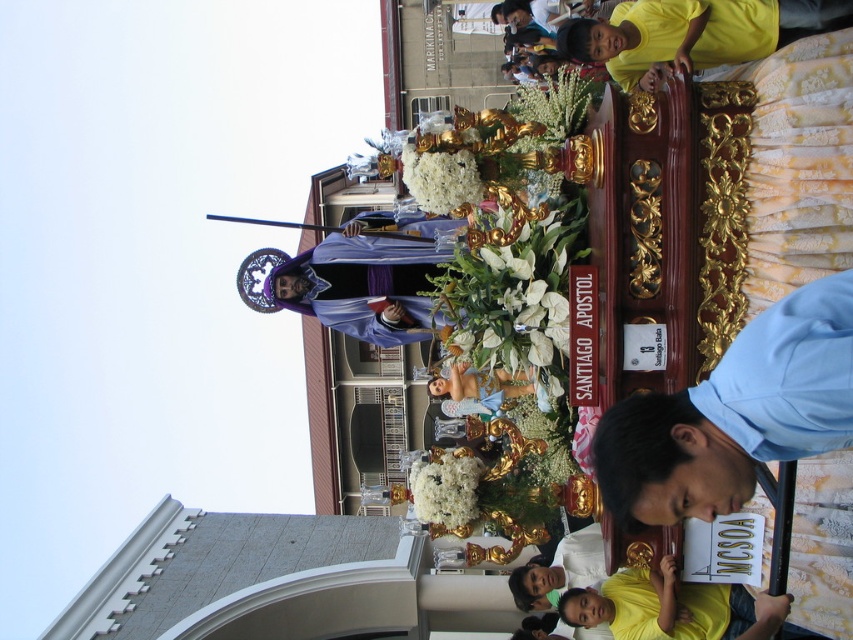
Question: Which object appears closest to the camera in this image?

Choices:
 (A) yellow matte shirt at lower right
 (B) purple velvet robe at center
 (C) light blue shirt at lower right

Answer: (C)

Question: Which of these objects is positioned closest to the light blue shirt at lower right?

Choices:
 (A) yellow matte shirt at lower right
 (B) purple velvet robe at center

Answer: (A)

Question: Does light blue shirt at lower right have a smaller size compared to purple velvet robe at center?

Choices:
 (A) yes
 (B) no

Answer: (A)

Question: Is light blue shirt at lower right to the right of purple velvet robe at center from the viewer's perspective?

Choices:
 (A) yes
 (B) no

Answer: (A)

Question: Based on their relative distances, which object is farther from the light blue shirt at lower right?

Choices:
 (A) purple velvet robe at center
 (B) yellow matte shirt at lower right

Answer: (A)

Question: Where is light blue shirt at lower right located in relation to purple velvet robe at center in the image?

Choices:
 (A) below
 (B) above

Answer: (A)